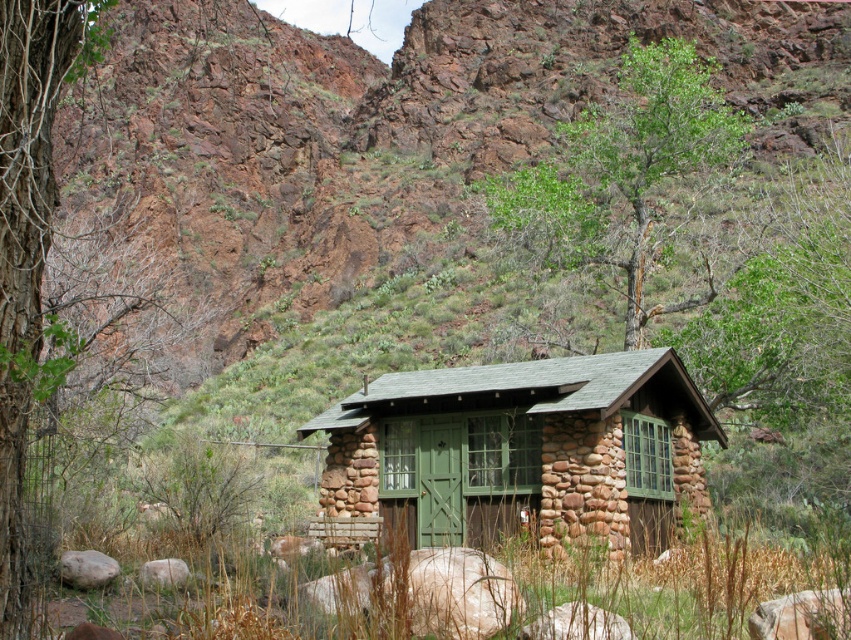
You are planning to build a garden path from the green stone cabin at center to the smooth bark tree at left. The path requires a minimum of 40 feet of space. Based on the scene, will you have enough space to construct this path?

The distance between the green stone cabin at center and the smooth bark tree at left is 42.65 feet, which exceeds the required 40 feet. Therefore, there is sufficient space to construct the garden path.

You are standing at the entrance of the cabin and want to walk to the green grass at center. Which direction should you move relative to the cabin?

The green grass at center is located at coordinates 0.922 on the x axis and 0.729 on the y axis, so you should move towards the center of the image to reach it.